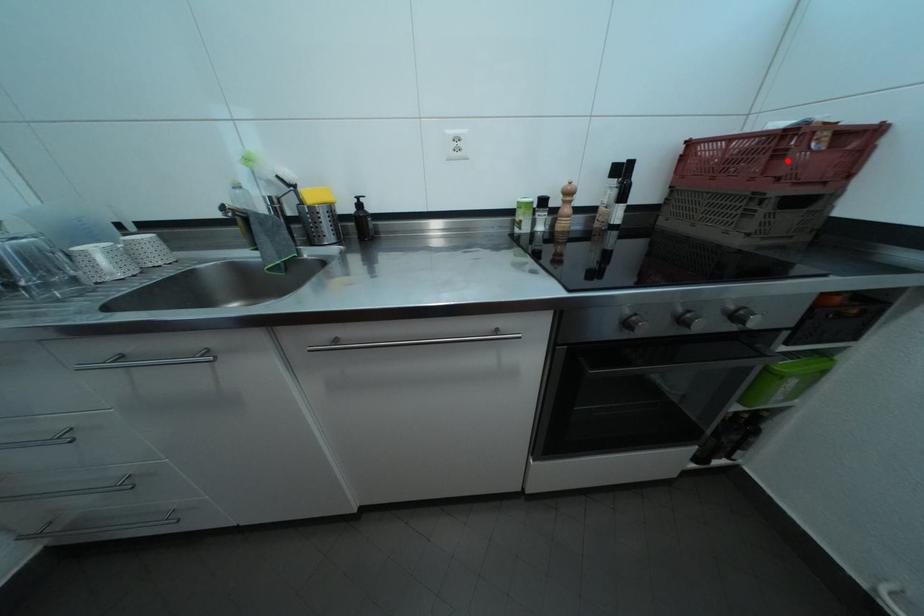
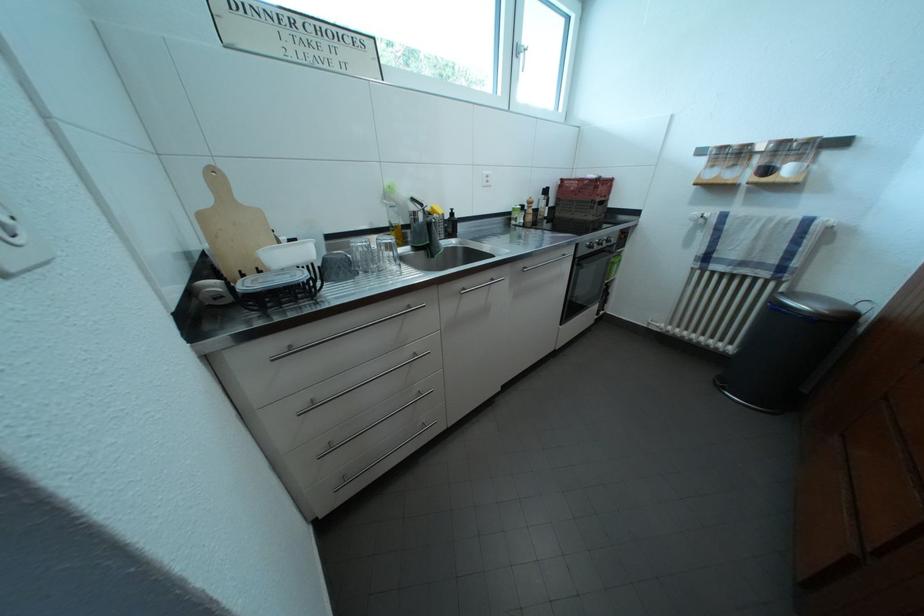
Question: I am providing you with two images of the same scene from different viewpoints. Image1 has a red point marked. In image2, the corresponding 3D location appears at what relative position? Reply with the corresponding letter.

Choices:
 (A) Closer
 (B) Farther

Answer: (A)